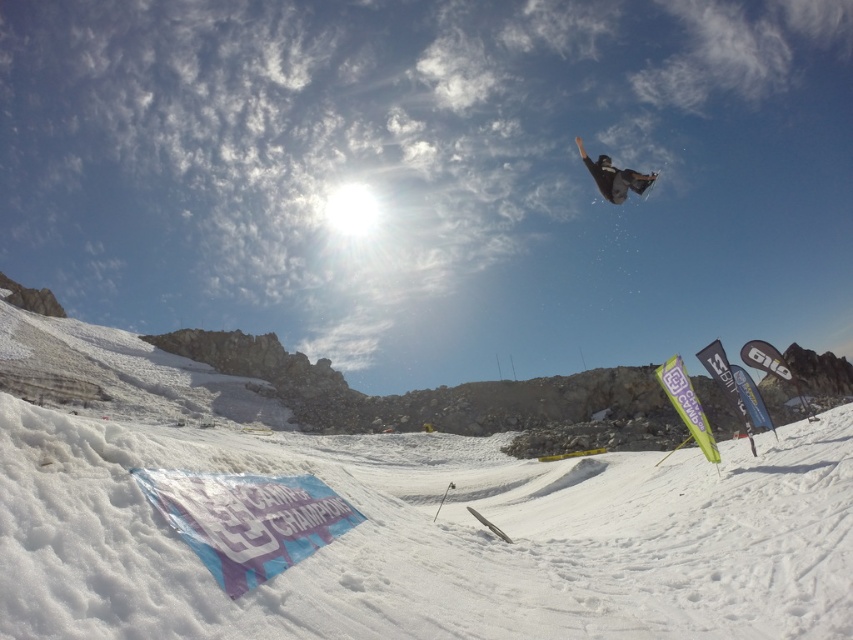
Question: Estimate the real-world distances between objects in this image. Which object is farther from the white fluffy snow at lower center?

Choices:
 (A) black matte snowboard at upper center
 (B) matte black snowboarder at upper right

Answer: (A)

Question: Among these objects, which one is farthest from the camera?

Choices:
 (A) white fluffy snow at lower center
 (B) black matte snowboard at upper center

Answer: (B)

Question: Where is matte black snowboarder at upper right located in relation to black matte snowboard at upper center in the image?

Choices:
 (A) right
 (B) left

Answer: (B)

Question: From the image, what is the correct spatial relationship of white fluffy snow at lower center in relation to matte black snowboarder at upper right?

Choices:
 (A) above
 (B) below

Answer: (B)

Question: Can you confirm if white fluffy snow at lower center is thinner than black matte snowboard at upper center?

Choices:
 (A) no
 (B) yes

Answer: (B)

Question: Which is farther from the matte black snowboarder at upper right?

Choices:
 (A) white fluffy snow at lower center
 (B) black matte snowboard at upper center

Answer: (A)